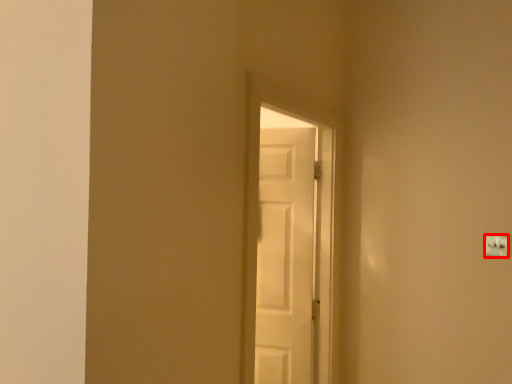
Question: From the image, what is the correct spatial relationship of light switch (annotated by the red box) in relation to door?

Choices:
 (A) left
 (B) right

Answer: (B)